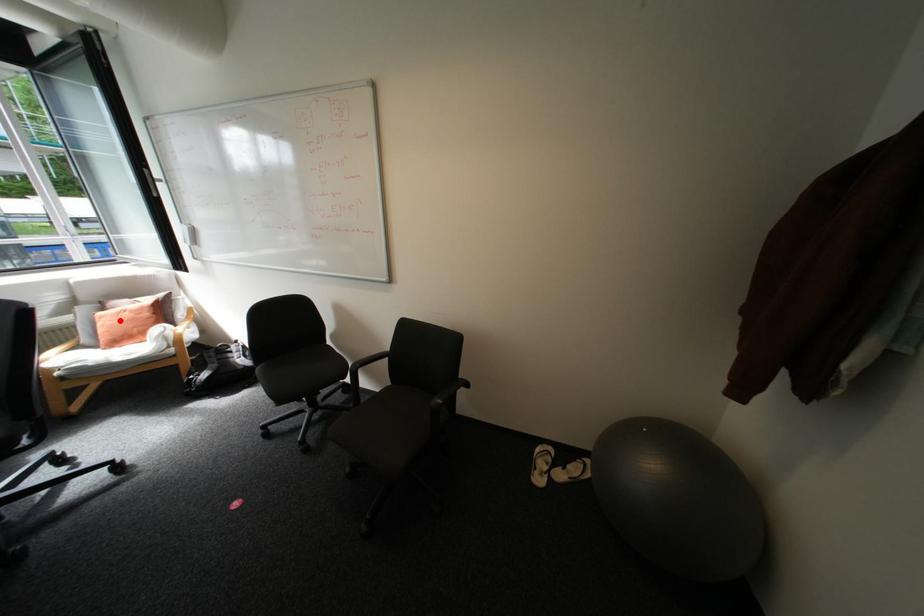
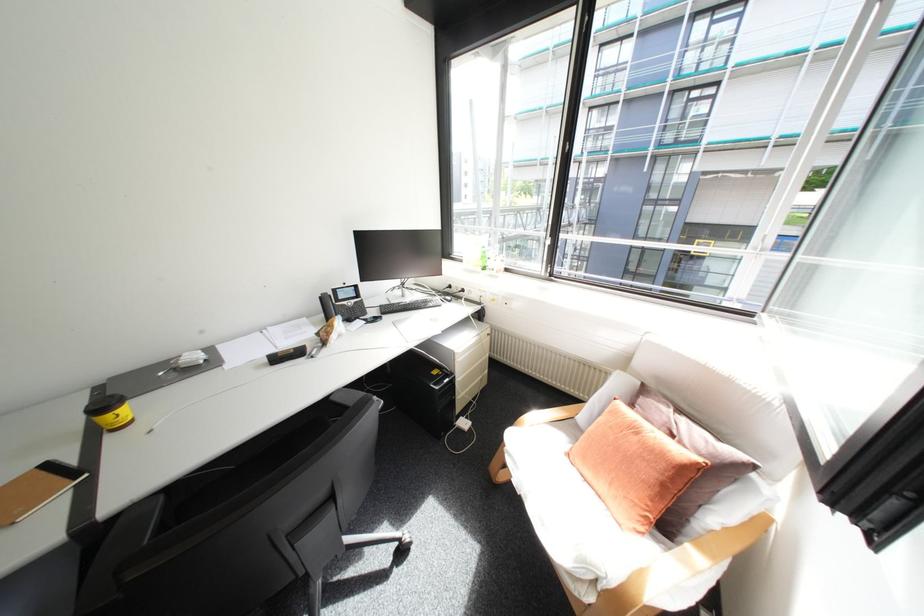
Question: I am providing you with two images of the same scene from different viewpoints. A red point is marked on the first image. At the location where the point appears in image 1, is it still visible in image 2?

Choices:
 (A) Yes
 (B) No

Answer: (A)